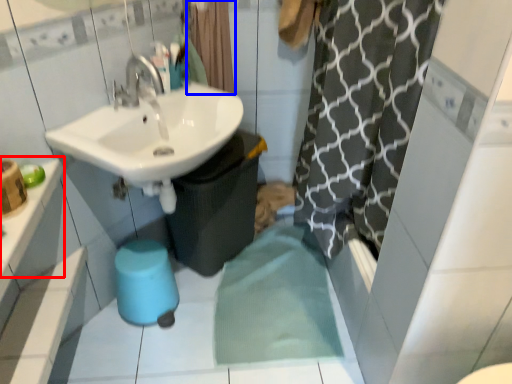
Question: Among these objects, which one is nearest to the camera, counter top (highlighted by a red box) or shower curtain (highlighted by a blue box)?

Choices:
 (A) counter top
 (B) shower curtain

Answer: (A)